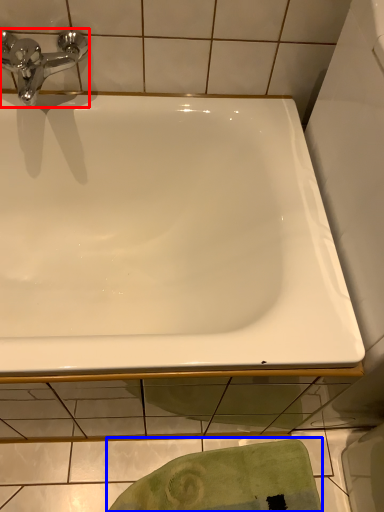
Question: Which object appears closest to the camera in this image, tap (highlighted by a red box) or bath towel (highlighted by a blue box)?

Choices:
 (A) tap
 (B) bath towel

Answer: (A)